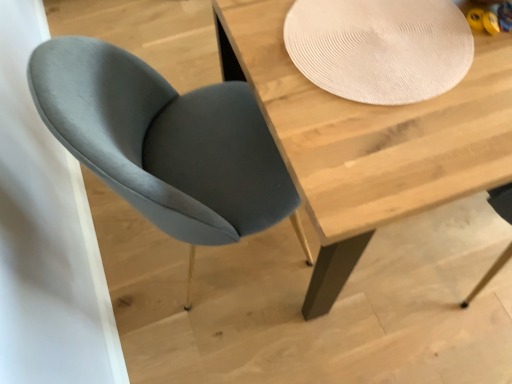
Find the location of a particular element. Image resolution: width=512 pixels, height=384 pixels. free space in front of beige textured placemat at upper center is located at coordinates (397, 155).